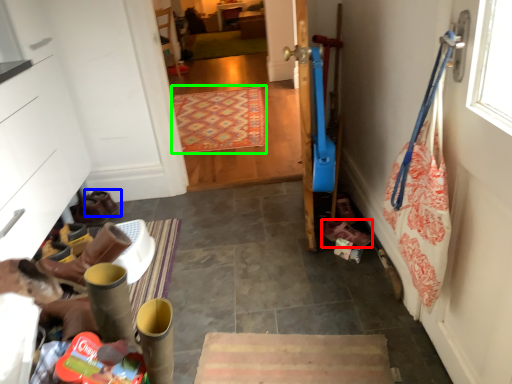
Question: Which is nearer to the footwear (highlighted by a red box)? footwear (highlighted by a blue box) or mat (highlighted by a green box).

Choices:
 (A) footwear
 (B) mat

Answer: (A)